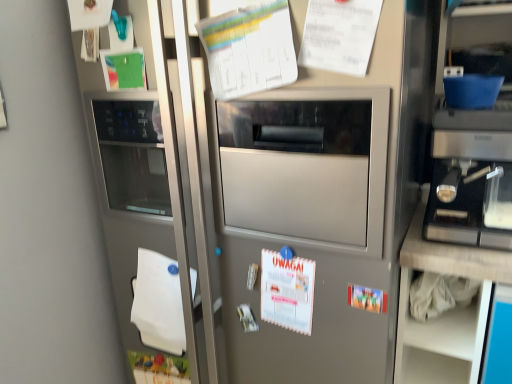
Question: Is white paper calendar at center, the 3th poster positioned from the top, positioned beyond the bounds of white paper at lower left?

Choices:
 (A) no
 (B) yes

Answer: (B)

Question: From a real-world perspective, is white paper calendar at center, which ranks as the second poster in bottom-to-top order, physically below white paper at lower left?

Choices:
 (A) yes
 (B) no

Answer: (B)

Question: Is white paper calendar at center, the 3th poster positioned from the top, bigger than white paper at lower left?

Choices:
 (A) no
 (B) yes

Answer: (A)

Question: Is white paper calendar at center, the 3th poster positioned from the top, shorter than white paper at lower left?

Choices:
 (A) no
 (B) yes

Answer: (B)

Question: Does white paper calendar at center, the 3th poster positioned from the top, have a greater height compared to white paper at lower left?

Choices:
 (A) yes
 (B) no

Answer: (B)

Question: From a real-world perspective, is sleek metallic espresso machine at right physically located above or below white paper at upper center, the second poster positioned from the top?

Choices:
 (A) above
 (B) below

Answer: (B)

Question: Do you think sleek metallic espresso machine at right is within white paper at upper center, the second poster positioned from the top, or outside of it?

Choices:
 (A) inside
 (B) outside

Answer: (B)

Question: Is sleek metallic espresso machine at right wider or thinner than white paper at upper center, positioned as the 3th poster in bottom-to-top order?

Choices:
 (A) wide
 (B) thin

Answer: (A)

Question: Is sleek metallic espresso machine at right taller or shorter than white paper at upper center, positioned as the 3th poster in bottom-to-top order?

Choices:
 (A) short
 (B) tall

Answer: (B)

Question: Would you say satin silver refrigerator at center is to the left or to the right of white paper at upper center, which appears as the first poster when viewed from the top, in the picture?

Choices:
 (A) right
 (B) left

Answer: (B)

Question: Is satin silver refrigerator at center bigger or smaller than white paper at upper center, which is the fourth poster in bottom-to-top order?

Choices:
 (A) small
 (B) big

Answer: (B)

Question: Is point (317, 243) closer or farther from the camera than point (346, 56)?

Choices:
 (A) farther
 (B) closer

Answer: (A)

Question: Looking at their shapes, would you say satin silver refrigerator at center is wider or thinner than white paper at upper center, which is the fourth poster in bottom-to-top order?

Choices:
 (A) thin
 (B) wide

Answer: (B)

Question: Is point (365, 286) positioned closer to the camera than point (496, 248)?

Choices:
 (A) farther
 (B) closer

Answer: (A)

Question: Relative to sleek metallic espresso machine at right, is matte plastic poster at center, marked as the fourth poster in a top-to-bottom arrangement, in front or behind?

Choices:
 (A) front
 (B) behind

Answer: (B)